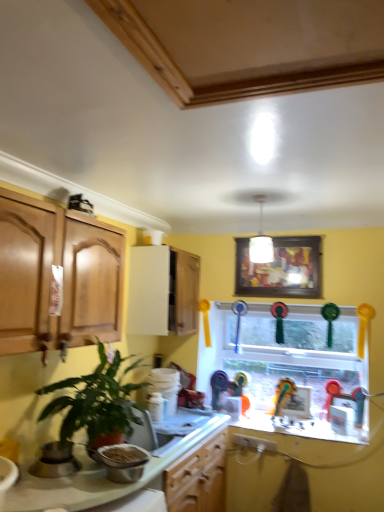
Question: Could you tell me if white glossy cabinet at upper center is turned towards metallic silver bowl at lower left, which is counted as the 2th appliance, starting from the left?

Choices:
 (A) no
 (B) yes

Answer: (A)

Question: Is white glossy cabinet at upper center to the right of metallic silver bowl at lower left, which is counted as the 2th appliance, starting from the left, from the viewer's perspective?

Choices:
 (A) no
 (B) yes

Answer: (B)

Question: Is white glossy cabinet at upper center oriented away from metallic silver bowl at lower left, which is counted as the 2th appliance, starting from the left?

Choices:
 (A) no
 (B) yes

Answer: (A)

Question: From a real-world perspective, is white glossy cabinet at upper center positioned under metallic silver bowl at lower left, which is counted as the 2th appliance, starting from the left, based on gravity?

Choices:
 (A) yes
 (B) no

Answer: (B)

Question: Is white glossy cabinet at upper center further to camera compared to metallic silver bowl at lower left, which appears as the first appliance when viewed from the right?

Choices:
 (A) no
 (B) yes

Answer: (B)

Question: Visually, is green glossy plant at lower left positioned to the left or to the right of white glossy cabinet at upper center?

Choices:
 (A) left
 (B) right

Answer: (A)

Question: Considering the positions of green glossy plant at lower left and white glossy cabinet at upper center in the image, is green glossy plant at lower left bigger or smaller than white glossy cabinet at upper center?

Choices:
 (A) big
 (B) small

Answer: (A)

Question: In the image, is green glossy plant at lower left positioned in front of or behind white glossy cabinet at upper center?

Choices:
 (A) front
 (B) behind

Answer: (A)

Question: Is green glossy plant at lower left wider or thinner than white glossy cabinet at upper center?

Choices:
 (A) thin
 (B) wide

Answer: (B)

Question: From a real-world perspective, is metallic silver bowl at lower left, which appears as the first appliance when viewed from the right, above or below white glossy cabinet at upper center?

Choices:
 (A) below
 (B) above

Answer: (A)

Question: From the image's perspective, is metallic silver bowl at lower left, which is counted as the 2th appliance, starting from the left, positioned above or below white glossy cabinet at upper center?

Choices:
 (A) below
 (B) above

Answer: (A)

Question: From their relative heights in the image, would you say metallic silver bowl at lower left, which is counted as the 2th appliance, starting from the left, is taller or shorter than white glossy cabinet at upper center?

Choices:
 (A) short
 (B) tall

Answer: (A)

Question: Considering the positions of metallic silver bowl at lower left, which appears as the first appliance when viewed from the right, and white glossy cabinet at upper center in the image, is metallic silver bowl at lower left, which appears as the first appliance when viewed from the right, bigger or smaller than white glossy cabinet at upper center?

Choices:
 (A) small
 (B) big

Answer: (A)

Question: Is wooden framed picture at upper center wider or thinner than glass window at center?

Choices:
 (A) thin
 (B) wide

Answer: (A)

Question: Is wooden framed picture at upper center inside or outside of glass window at center?

Choices:
 (A) inside
 (B) outside

Answer: (B)